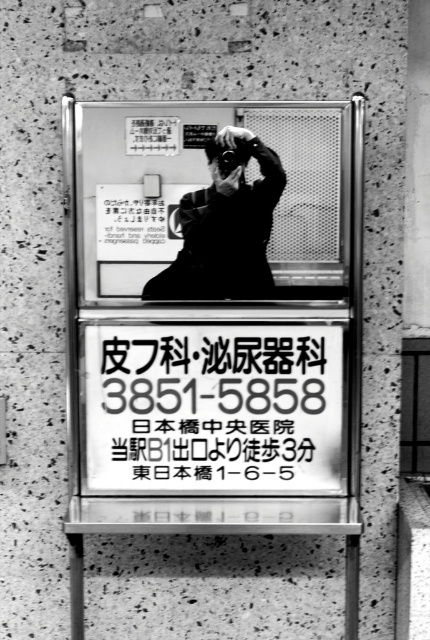
You are standing in front of the mirror in the image. You notice two points marked on the wall. One is at coordinates point (193, 474) and the other at point (267, 186). Which point is closer to you?

Point (193, 474) is further to the viewer than point (267, 186), so the point closer to you is point (267, 186).

You are a photographer holding a matte black camera at center and standing in front of a black paper sign at center. Can you fit the entire sign into your camera frame without moving your position?

The black paper sign at center might be wider than matte black camera at center, so there is a possibility that the entire sign cannot be captured in the camera frame without adjusting your position or zoom level.

You are a photographer trying to capture a clear shot of the black paper sign at center and the matte black camera at center. Since both are matte black, which object might be harder to photograph due to its size?

The black paper sign at center is larger in size than the matte black camera at center, so the matte black camera at center might be harder to photograph because its smaller size could blend into the dark background more easily.